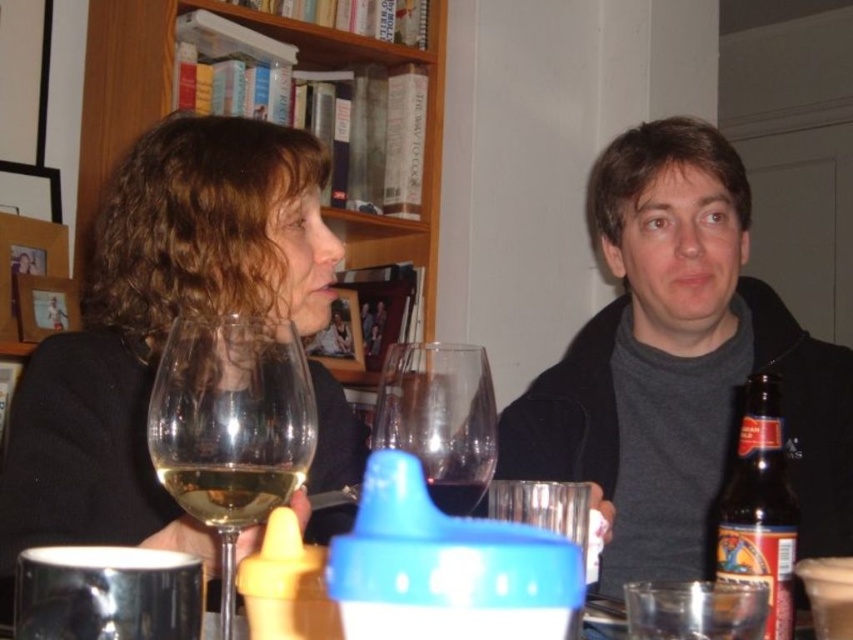
Question: Can you confirm if matte black sweater at upper left is wider than brown glass bottle at right?

Choices:
 (A) yes
 (B) no

Answer: (A)

Question: Estimate the real-world distances between objects in this image. Which object is farther from the transparent glass at center?

Choices:
 (A) brown glass bottle at right
 (B) matte black sweater at upper left

Answer: (B)

Question: Which is nearer to the transparent glass at center?

Choices:
 (A) dark gray sweater at center
 (B) wooden bookshelf at upper left
 (C) matte black sweater at upper left
 (D) brown glass bottle at right

Answer: (D)

Question: Is dark gray sweater at center to the right of brown glass bottle at right from the viewer's perspective?

Choices:
 (A) no
 (B) yes

Answer: (B)

Question: Which is farther from the transparent glass wine at left?

Choices:
 (A) dark gray sweater at center
 (B) brown glass bottle at right
 (C) translucent glass wine at center

Answer: (A)

Question: Does transparent glass at center appear on the right side of brown glass bottle at right?

Choices:
 (A) no
 (B) yes

Answer: (A)